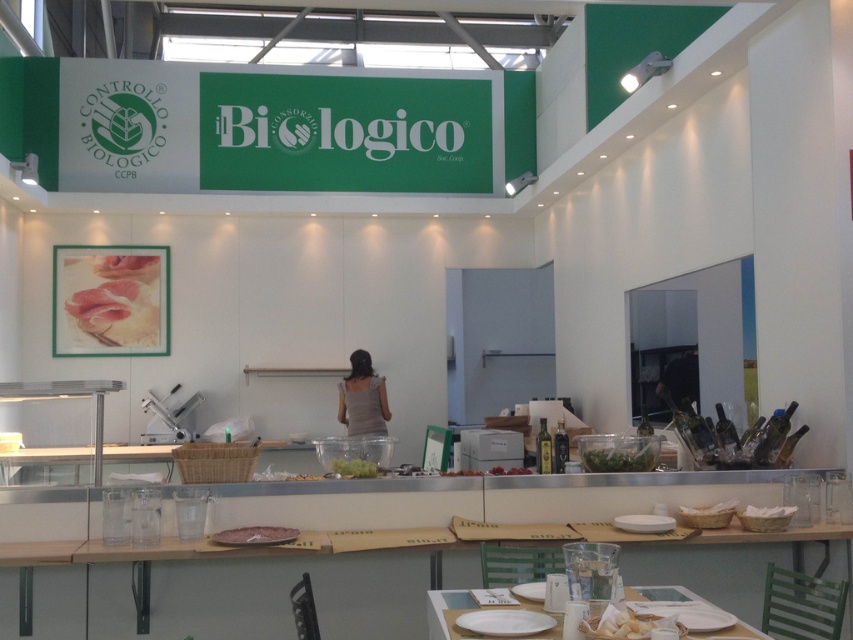
Question: Which object appears closest to the camera in this image?

Choices:
 (A) green leafy salad at center
 (B) green leafy vegetable at center

Answer: (A)

Question: Does gray fabric dress at center have a larger size compared to green leafy vegetable at center?

Choices:
 (A) yes
 (B) no

Answer: (A)

Question: Which point is closer to the camera taking this photo?

Choices:
 (A) (228, 545)
 (B) (369, 435)
 (C) (631, 598)

Answer: (C)

Question: Does white glossy plate at lower center come in front of pinkish matte meat at lower center?

Choices:
 (A) yes
 (B) no

Answer: (A)

Question: Estimate the real-world distances between objects in this image. Which object is farther from the pinkish matte meat at lower center?

Choices:
 (A) white glossy plate at lower center
 (B) green leafy salad at center
 (C) green leafy vegetable at center
 (D) gray fabric dress at center

Answer: (D)

Question: Does gray fabric dress at center have a larger size compared to green leafy vegetable at center?

Choices:
 (A) no
 (B) yes

Answer: (B)